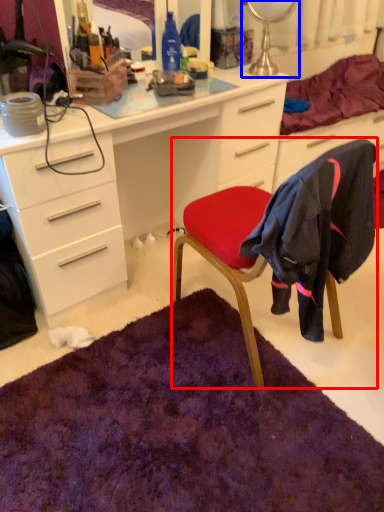
Question: Which point is further to the camera, chair (highlighted by a red box) or table lamp (highlighted by a blue box)?

Choices:
 (A) chair
 (B) table lamp

Answer: (B)